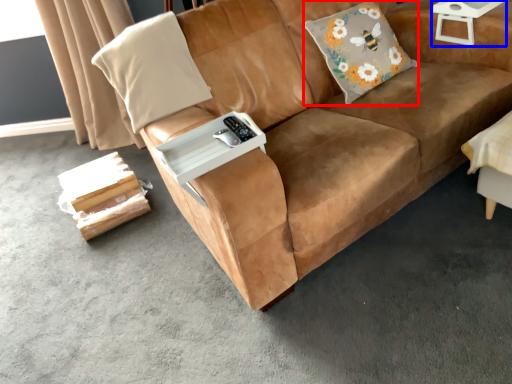
Question: Which object is further to the camera taking this photo, throw pillow (highlighted by a red box) or side table (highlighted by a blue box)?

Choices:
 (A) throw pillow
 (B) side table

Answer: (B)